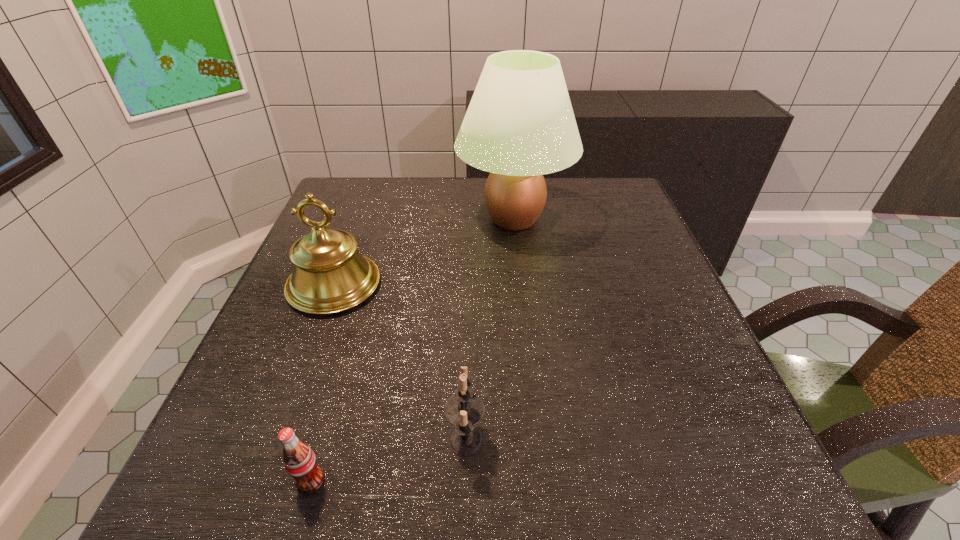
Where is `vacant space at the left edge of the desktop`? Image resolution: width=960 pixels, height=540 pixels. vacant space at the left edge of the desktop is located at coordinates (250, 415).

Where is `vacant space at the right edge of the desktop`? The width and height of the screenshot is (960, 540). vacant space at the right edge of the desktop is located at coordinates [712, 416].

The width and height of the screenshot is (960, 540). I want to click on vacant space at the far left corner of the desktop, so click(355, 219).

At what (x,y) coordinates should I click in order to perform the action: click on vacant space at the near left corner of the desktop. Please return your answer as a coordinate pair (x, y). This screenshot has height=540, width=960. Looking at the image, I should click on (289, 509).

This screenshot has height=540, width=960. In order to click on vacant space at the far right corner in this screenshot , I will do `click(617, 204)`.

Find the location of `vacant space at the near right corner of the desktop`. vacant space at the near right corner of the desktop is located at coordinates (722, 511).

At what (x,y) coordinates should I click in order to perform the action: click on unoccupied position between the candle holder and the soda. Please return your answer as a coordinate pair (x, y). The height and width of the screenshot is (540, 960). Looking at the image, I should click on (388, 460).

You are a GUI agent. You are given a task and a screenshot of the screen. Output one action in this format:
    pyautogui.click(x=<x>, y=<y>)
    Task: Click on the free point between the shortest object and the farthest object
    
    Given the screenshot: What is the action you would take?
    pyautogui.click(x=412, y=350)

Find the location of a particular element. unoccupied position between the soda and the second shortest object is located at coordinates (388, 460).

Identify the location of free spot between the shortest object and the candle holder. The height and width of the screenshot is (540, 960). (388, 460).